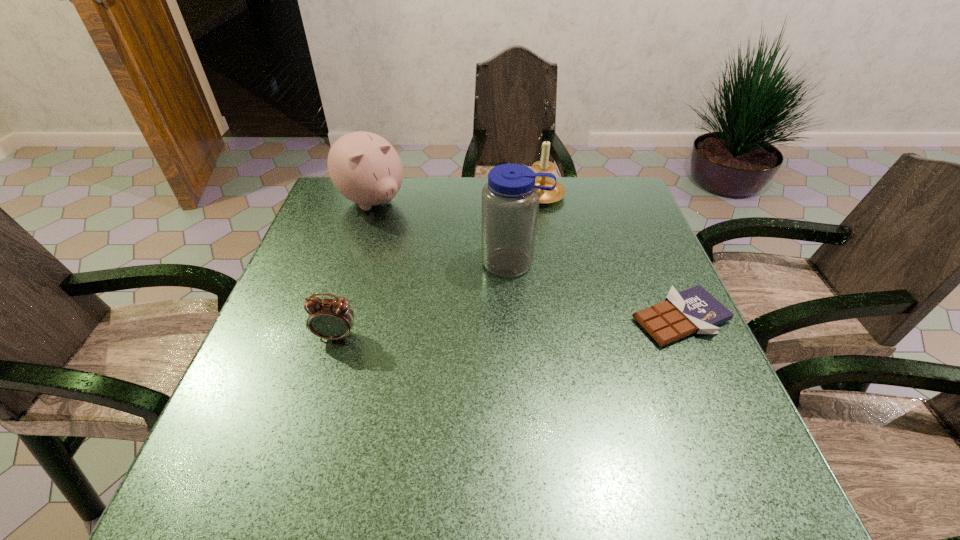
In order to click on free spot located 0.210m at the snout of the piggy bank in this screenshot , I will do `click(429, 259)`.

At what (x,y) coordinates should I click in order to perform the action: click on free space located 0.110m at the snout of the piggy bank. Please return your answer as a coordinate pair (x, y). This screenshot has height=540, width=960. Looking at the image, I should click on (409, 239).

Locate an element on the screen. Image resolution: width=960 pixels, height=540 pixels. vacant area located 0.170m with a handle on the side of the candle holder is located at coordinates (517, 246).

Where is `vacant space located with a handle on the side of the candle holder`? Image resolution: width=960 pixels, height=540 pixels. vacant space located with a handle on the side of the candle holder is located at coordinates (498, 283).

This screenshot has width=960, height=540. I want to click on vacant point located 0.300m with a handle on the side of the candle holder, so click(x=501, y=278).

Locate an element on the screen. The image size is (960, 540). vacant position located with a carrying loop on the side of the water bottle is located at coordinates (480, 389).

Identify the location of vacant space located 0.400m with a carrying loop on the side of the water bottle. Image resolution: width=960 pixels, height=540 pixels. (468, 432).

The width and height of the screenshot is (960, 540). In order to click on vacant space located 0.230m with a carrying loop on the side of the water bottle in this screenshot , I will do `click(489, 355)`.

At what (x,y) coordinates should I click in order to perform the action: click on piggy bank present at the far edge. Please return your answer as a coordinate pair (x, y). This screenshot has height=540, width=960. Looking at the image, I should click on (365, 168).

Identify the location of candle holder located in the far edge section of the desktop. Image resolution: width=960 pixels, height=540 pixels. 544,165.